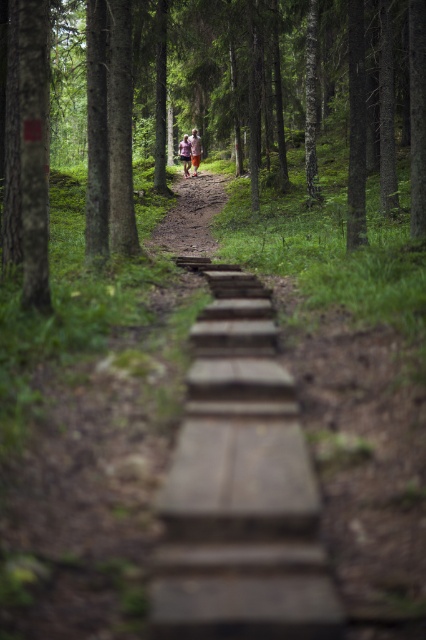
You are standing at the starting point of the forest path and see the brown wooden trail at center marked by point (x=190, y=216). If you walk straight ahead, will you eventually reach the two individuals walking away from the camera?

Yes, walking straight ahead along the brown wooden trail at center marked by point (x=190, y=216) will lead you towards the two individuals walking away from the camera since the path is winding through the forest towards them.

You are standing at the start of the forest path and see the wooden steps at center and the white fabric person at center ahead. Which object is located to the right when facing towards them?

The wooden steps at center is positioned on the right side of the white fabric person at center, so when facing towards them, the wooden steps at center is to the right.

You are standing at the wooden planks in the foreground of the forest scene. You see two points marked in the image. Which point, point [261,522] or point [187,148], is closer to you?

Point [261,522] is closer to the viewer than point [187,148].